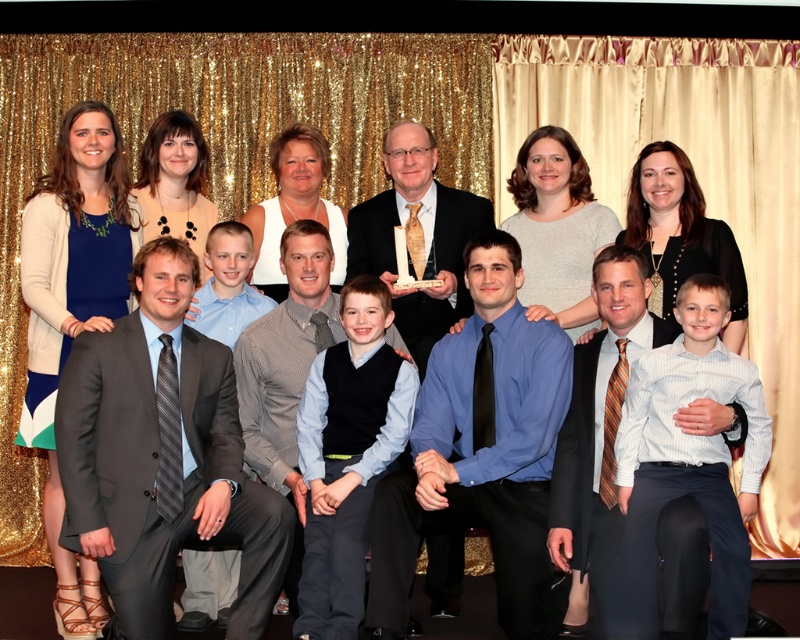
You are a photographer adjusting the lighting for the group photo. You notice the blue satin shirt at center and the matte black suit at center. Which clothing item requires more space to avoid overlapping with adjacent subjects?

The blue satin shirt at center requires more space because its width is larger than the matte black suit at center, so it needs more room to prevent overlapping with nearby subjects.

You are a photographer at the event and need to adjust the lighting to ensure both the gray suit at center and the blue satin shirt at center are well lit. Since the left side has a gold curtain and the right side has a cream curtain, which side should you position the light source to best highlight both outfits?

The gray suit at center is to the left of the blue satin shirt at center. To best highlight both, position the light source towards the left side with the gold curtain. This will illuminate the gray suit first and then the blue shirt, ensuring both are well lit without harsh shadows.

You are a photographer trying to adjust the lighting for the group photo. You notice the blue satin shirt at center and the gray textured suit at center. Which one requires more space between them to avoid overlapping in the frame?

The blue satin shirt at center might be wider than the gray textured suit at center, so you should leave more space between them to prevent overlapping.